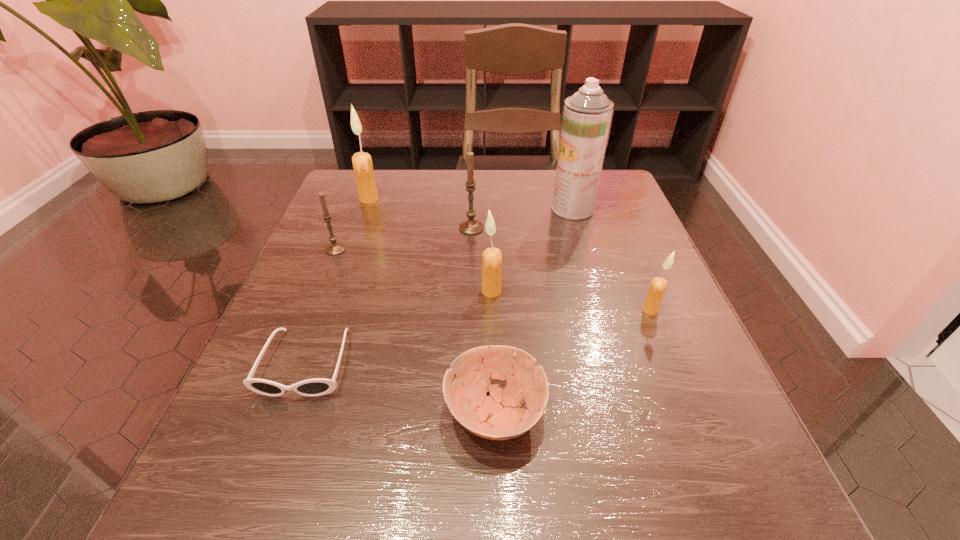
This screenshot has width=960, height=540. I want to click on empty space that is in between the bowl and the sunglasses, so click(x=400, y=388).

Find the location of a particular element. vacant area that lies between the bowl and the second object from right to left is located at coordinates (534, 310).

At what (x,y) coordinates should I click in order to perform the action: click on free space between the seventh shortest object and the farther gray candle. Please return your answer as a coordinate pair (x, y). This screenshot has height=540, width=960. Looking at the image, I should click on (420, 214).

This screenshot has width=960, height=540. I want to click on object that stands as the sixth closest to the farther gray candle, so click(657, 288).

The width and height of the screenshot is (960, 540). I want to click on object that is the sixth closest to the smallest cream candle, so [335, 248].

Locate which candle ranks fourth in proximity to the second biggest cream candle. Please provide its 2D coordinates. Your answer should be formatted as a tuple, i.e. [(x, y)], where the tuple contains the x and y coordinates of a point satisfying the conditions above.

[(362, 163)]

Identify the location of the fourth closest candle to the farthest candle. click(x=657, y=288).

Identify which cream candle is located as the third nearest to the bowl. Please provide its 2D coordinates. Your answer should be formatted as a tuple, i.e. [(x, y)], where the tuple contains the x and y coordinates of a point satisfying the conditions above.

[(362, 163)]

Locate which cream candle ranks second in proximity to the second tallest object. Please provide its 2D coordinates. Your answer should be formatted as a tuple, i.e. [(x, y)], where the tuple contains the x and y coordinates of a point satisfying the conditions above.

[(657, 288)]